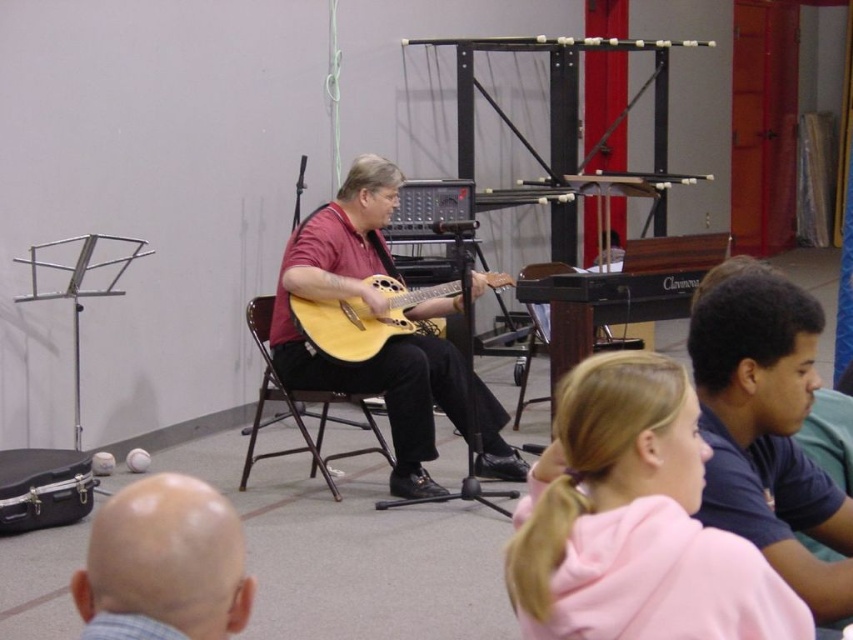
Question: Is bald head at lower left further to camera compared to metallic silver chair at center?

Choices:
 (A) no
 (B) yes

Answer: (A)

Question: Among these points, which one is nearest to the camera?

Choices:
 (A) (782, 451)
 (B) (158, 476)

Answer: (B)

Question: Among these points, which one is nearest to the camera?

Choices:
 (A) (312, 390)
 (B) (142, 593)

Answer: (B)

Question: Is dark blue shirt at lower right closer to camera compared to bald head at lower left?

Choices:
 (A) no
 (B) yes

Answer: (A)

Question: Estimate the real-world distances between objects in this image. Which object is closer to the matte wood guitar at center?

Choices:
 (A) metallic silver chair at center
 (B) light wood acoustic guitar at center
 (C) dark blue shirt at lower right

Answer: (B)

Question: Is pink fleece hoodie at lower right positioned behind dark blue shirt at lower right?

Choices:
 (A) yes
 (B) no

Answer: (B)